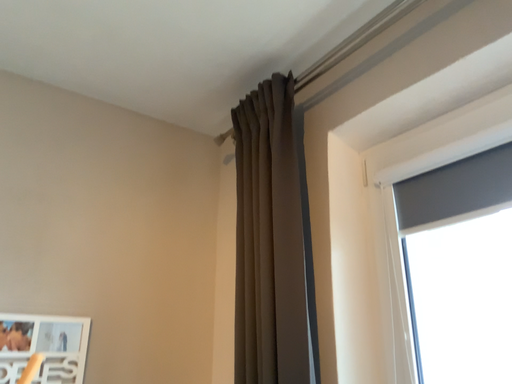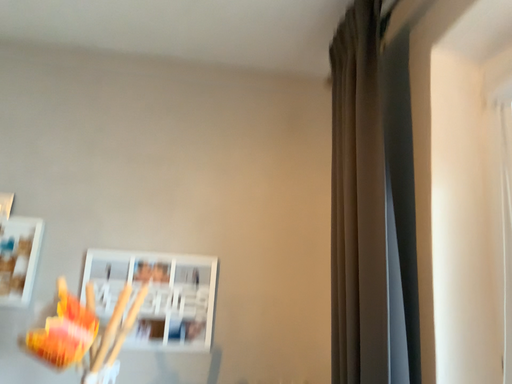
Question: Which way did the camera rotate in the video?

Choices:
 (A) rotated upward
 (B) rotated downward

Answer: (B)